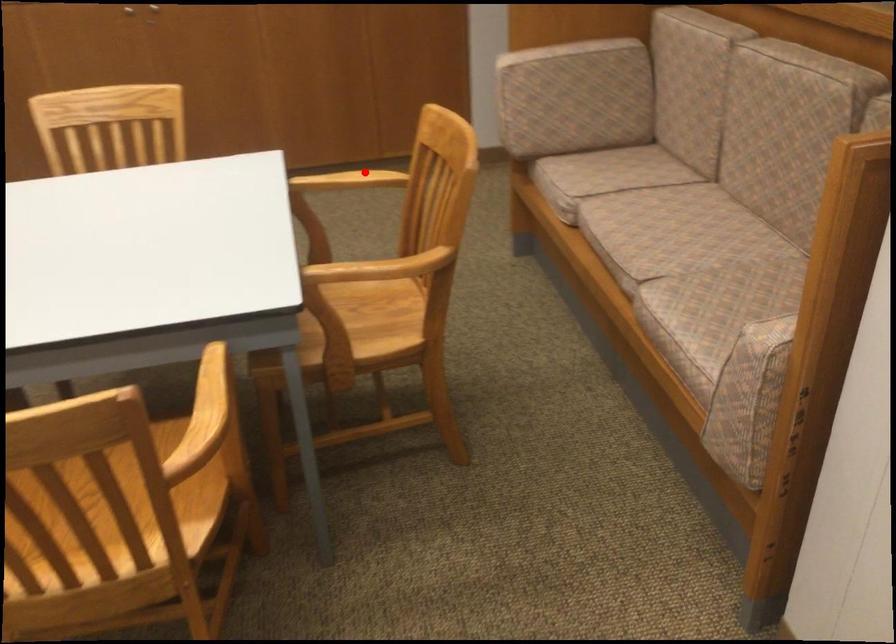
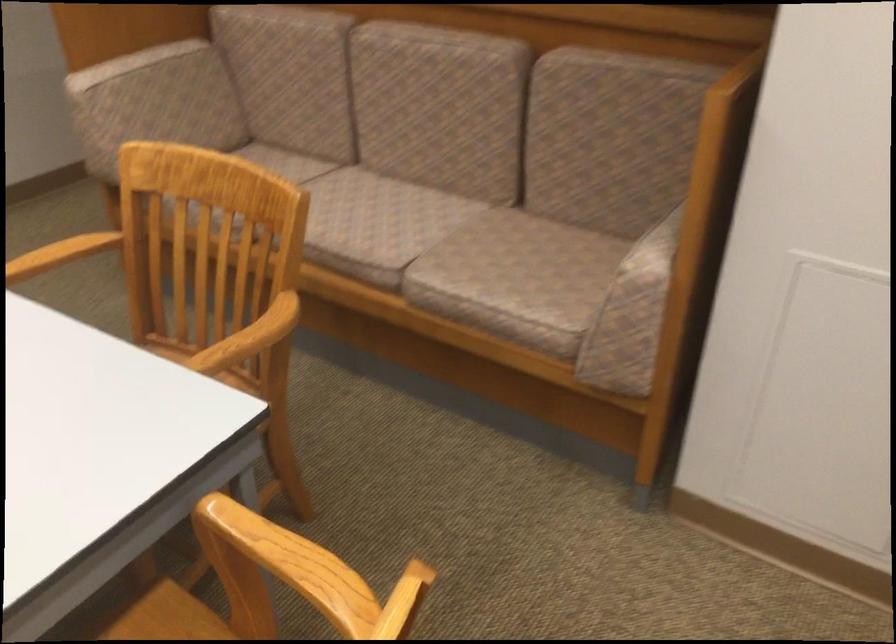
In the second image, find the point that corresponds to the highlighted location in the first image.

(62, 252)